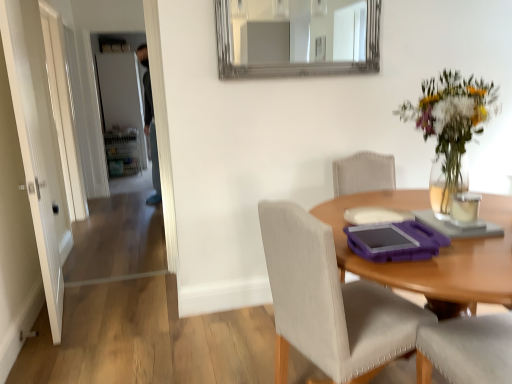
Question: Is clear glass candle at upper right taller or shorter than matte purple tray at center?

Choices:
 (A) tall
 (B) short

Answer: (B)

Question: Considering the positions of point (471, 218) and point (345, 312), is point (471, 218) closer or farther from the camera than point (345, 312)?

Choices:
 (A) closer
 (B) farther

Answer: (A)

Question: Which object is the farthest from the wooden table at center?

Choices:
 (A) silver-framed mirror at upper center
 (B) matte purple tray at center
 (C) clear glass candle at upper right
 (D) white glossy door at left, arranged as the second door when viewed from the back
 (E) white glossy door at left

Answer: (A)

Question: Estimate the real-world distances between objects in this image. Which object is closer to the translucent glass vase at upper right?

Choices:
 (A) white matte door at upper left, which ranks as the 1th door in back-to-front order
 (B) clear glass candle at upper right
 (C) white glossy door at left, arranged as the second door when viewed from the back
 (D) silver-framed mirror at upper center
 (E) matte purple tray at center

Answer: (B)